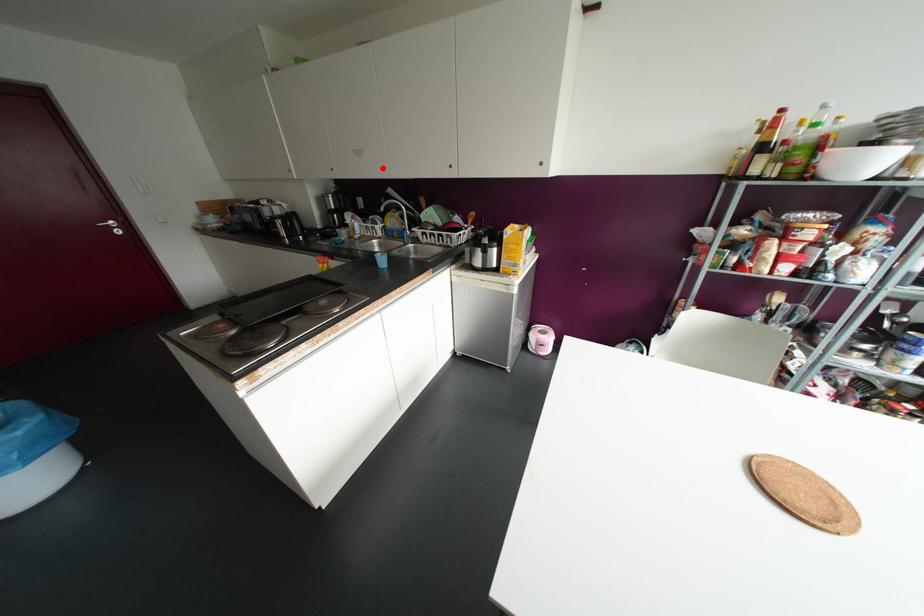
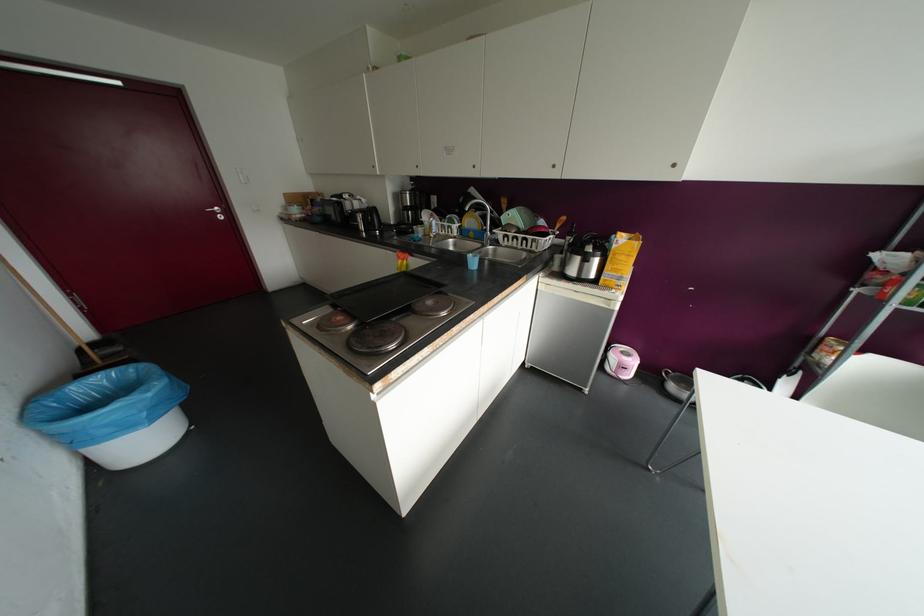
Where in the second image is the point corresponding to the highlighted location from the first image?

(473, 166)